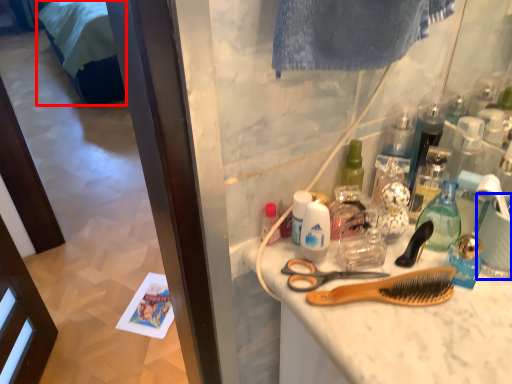
Question: Among these objects, which one is farthest to the camera, bed (highlighted by a red box) or coffee cup (highlighted by a blue box)?

Choices:
 (A) bed
 (B) coffee cup

Answer: (A)